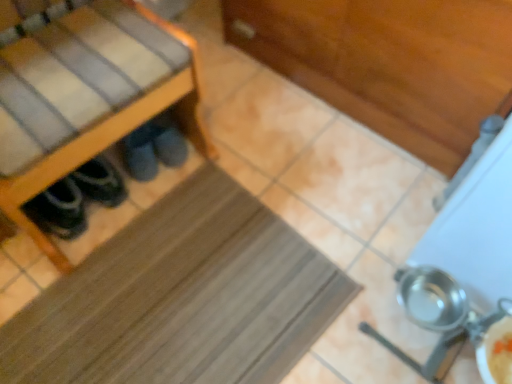
Where is `free area in between dark gray suede slippers at lower left and metallic silver pot at lower right`? The width and height of the screenshot is (512, 384). free area in between dark gray suede slippers at lower left and metallic silver pot at lower right is located at coordinates (274, 225).